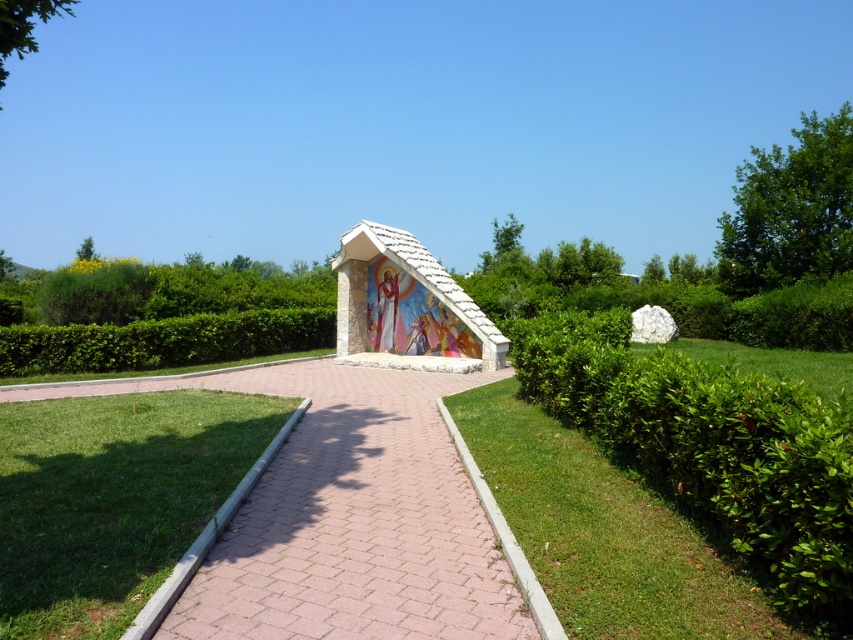
You are a visitor approaching the white stone shrine at center and the green grass at lower left. Which object is closer to you as you walk along the pathway?

The white stone shrine at center is closer to you because it is in front of the green grass at lower left, indicating it is positioned nearer along the pathway.

You are standing on the paved pathway leading to the white stone gazebo at center and want to reach the green leafy grass at right. Which direction should you move relative to the gazebo?

The green leafy grass at right is located below the white stone gazebo at center, so you should move downward from the gazebo to reach it.